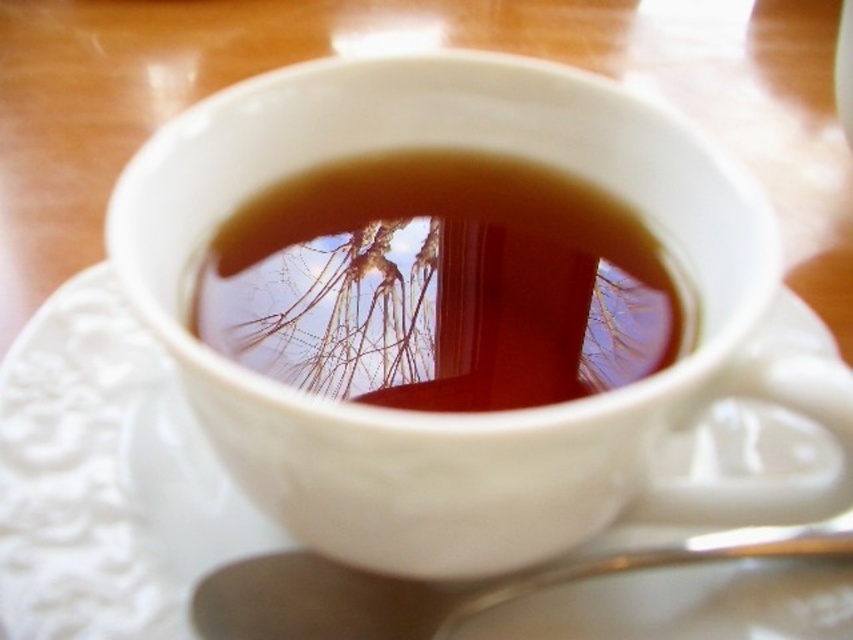
Does white textured saucer at center have a smaller size compared to silver metallic spoon at lower center?

Actually, white textured saucer at center might be larger than silver metallic spoon at lower center.

Does white textured saucer at center have a larger size compared to silver metallic spoon at lower center?

Yes, white textured saucer at center is bigger than silver metallic spoon at lower center.

The height and width of the screenshot is (640, 853). Identify the location of white textured saucer at center. (149, 504).

Where is `white textured saucer at center`? white textured saucer at center is located at coordinates (149, 504).

Does white textured saucer at center have a greater width compared to brown glossy liquid at center?

Yes, white textured saucer at center is wider than brown glossy liquid at center.

What do you see at coordinates (149, 504) in the screenshot?
I see `white textured saucer at center` at bounding box center [149, 504].

Which is in front, point (141, 589) or point (236, 317)?

Positioned in front is point (236, 317).

I want to click on white textured saucer at center, so click(149, 504).

Does brown glossy liquid at center appear over silver metallic spoon at lower center?

Yes, brown glossy liquid at center is above silver metallic spoon at lower center.

What do you see at coordinates (439, 285) in the screenshot? I see `brown glossy liquid at center` at bounding box center [439, 285].

The image size is (853, 640). I want to click on brown glossy liquid at center, so click(x=439, y=285).